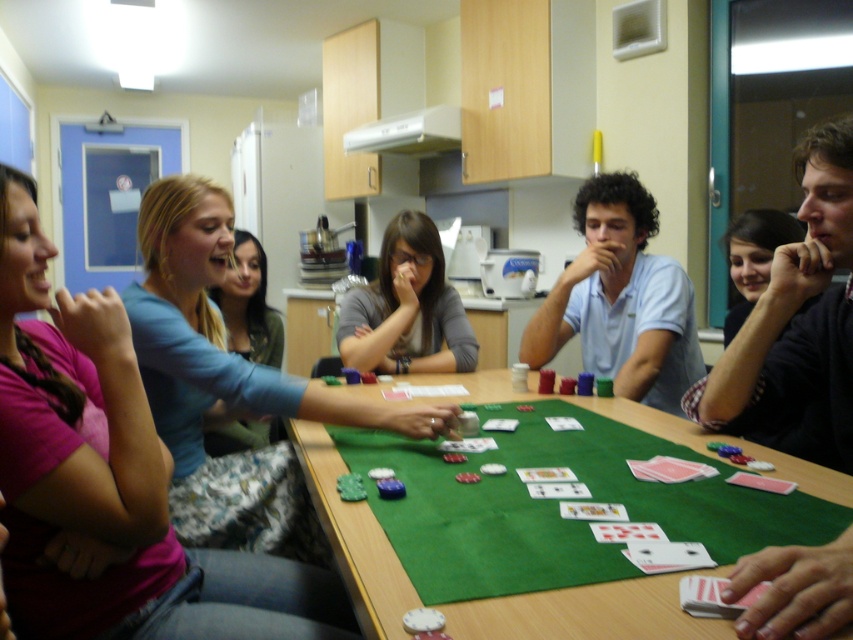
You are a photographer trying to capture a candid shot of the black matte shirt at center and the matte gray shirt at center during the card game. Since you want to ensure both shirts are clearly visible in the frame, which shirt should you focus on first to account for their sizes?

The black matte shirt at center has a lesser width compared to the matte gray shirt at center. Therefore, you should focus on the black matte shirt at center first as it is smaller and requires precise focus to ensure clarity.

You are at the center of the room and want to move to the location of the matte gray shirt at center. What are the coordinates you need to move to?

The coordinates to move to are at point (407, 308).

You are a photographer trying to capture a candid shot of the black matte shirt at center and the matte gray shirt at center. Since you want to ensure both are clearly visible, which shirt should you focus on first to ensure proper focus given their sizes?

The black matte shirt at center is bigger than the matte gray shirt at center, so focusing on the larger black matte shirt at center first would ensure both are in focus as it occupies more space in the frame.